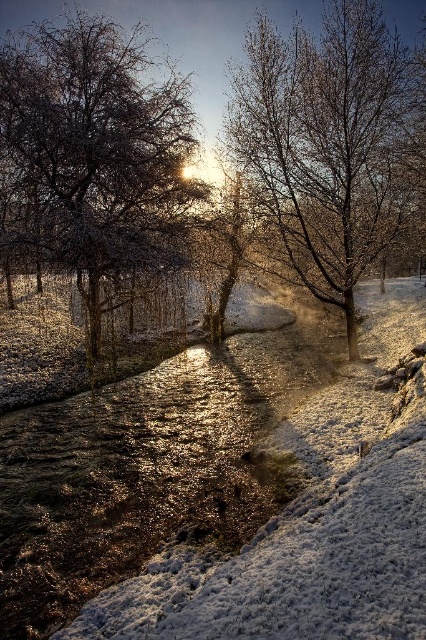
Looking at this image, you are standing at the origin point in the winter scene. There are two points marked in the image. Which point is closer to you, point (75, 67) or point (331, 44)?

Point (331, 44) is closer to you because point (75, 67) is behind it.